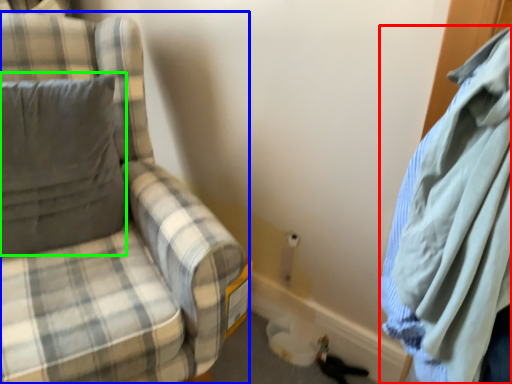
Question: Which is farther away from cloak (highlighted by a red box)? chair (highlighted by a blue box) or pillow (highlighted by a green box)?

Choices:
 (A) chair
 (B) pillow

Answer: (B)